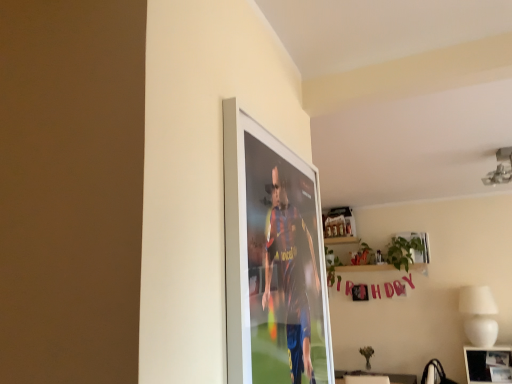
Question: Is the position of metallic silver picture frame at upper right, the second picture frame positioned from the front, more distant than that of white ceramic lamp at lower right?

Choices:
 (A) no
 (B) yes

Answer: (B)

Question: Is metallic silver picture frame at upper right, the second picture frame from the right, beside white ceramic lamp at lower right?

Choices:
 (A) yes
 (B) no

Answer: (B)

Question: From a real-world perspective, is metallic silver picture frame at upper right, positioned as the first picture frame in back-to-front order, beneath white ceramic lamp at lower right?

Choices:
 (A) yes
 (B) no

Answer: (B)

Question: From a real-world perspective, is metallic silver picture frame at upper right, which is the first picture frame in left-to-right order, located higher than white ceramic lamp at lower right?

Choices:
 (A) no
 (B) yes

Answer: (B)

Question: Is metallic silver picture frame at upper right, positioned as the first picture frame in back-to-front order, facing away from white ceramic lamp at lower right?

Choices:
 (A) yes
 (B) no

Answer: (B)

Question: Considering the relative sizes of metallic silver picture frame at upper right, the second picture frame from the right, and white ceramic lamp at lower right in the image provided, is metallic silver picture frame at upper right, the second picture frame from the right, taller than white ceramic lamp at lower right?

Choices:
 (A) yes
 (B) no

Answer: (B)

Question: From the image's perspective, does green leafy plant at upper center appear higher than white ceramic lamp at lower right?

Choices:
 (A) no
 (B) yes

Answer: (B)

Question: Is the depth of green leafy plant at upper center greater than that of white ceramic lamp at lower right?

Choices:
 (A) yes
 (B) no

Answer: (A)

Question: Does green leafy plant at upper center have a greater width compared to white ceramic lamp at lower right?

Choices:
 (A) yes
 (B) no

Answer: (B)

Question: Considering the relative sizes of green leafy plant at upper center and white ceramic lamp at lower right in the image provided, is green leafy plant at upper center smaller than white ceramic lamp at lower right?

Choices:
 (A) no
 (B) yes

Answer: (B)

Question: Is green leafy plant at upper center bigger than white ceramic lamp at lower right?

Choices:
 (A) no
 (B) yes

Answer: (A)

Question: Is green leafy plant at upper center completely or partially outside of white ceramic lamp at lower right?

Choices:
 (A) yes
 (B) no

Answer: (A)

Question: Is metallic silver photo frame at lower right, the first picture frame ordered from the bottom, to the left of metallic silver picture frame at upper right, which is the first picture frame in left-to-right order, from the viewer's perspective?

Choices:
 (A) yes
 (B) no

Answer: (B)